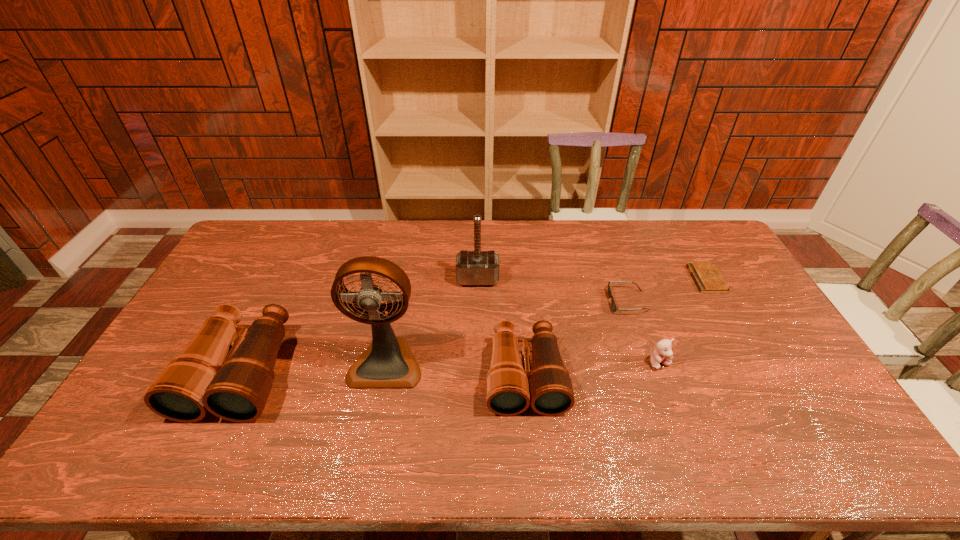
Identify the location of object situated at the left edge. The width and height of the screenshot is (960, 540). pos(202,378).

The image size is (960, 540). What are the coordinates of `object located at the right edge` in the screenshot? It's located at (707, 277).

Locate an element on the screen. This screenshot has width=960, height=540. object at the near left corner is located at coordinates (202, 378).

The height and width of the screenshot is (540, 960). In the image, there is a desktop. In order to click on free space at the far edge in this screenshot , I will do `click(402, 224)`.

In order to click on free space at the near edge in this screenshot , I will do `click(325, 411)`.

Find the location of `vacant point at the left edge`. vacant point at the left edge is located at coordinates (164, 366).

Locate an element on the screen. This screenshot has height=540, width=960. free space at the right edge of the desktop is located at coordinates (719, 309).

You are a GUI agent. You are given a task and a screenshot of the screen. Output one action in this format:
    pyautogui.click(x=<x>, y=<y>)
    Task: Click on the vacant area that lies between the shortest object and the sunglasses
    
    Given the screenshot: What is the action you would take?
    pyautogui.click(x=667, y=291)

Where is `empty location between the sunglasses and the shorter binoculars`? This screenshot has width=960, height=540. empty location between the sunglasses and the shorter binoculars is located at coordinates (576, 339).

Where is `free area in between the second shortest object and the hammer`? free area in between the second shortest object and the hammer is located at coordinates (553, 290).